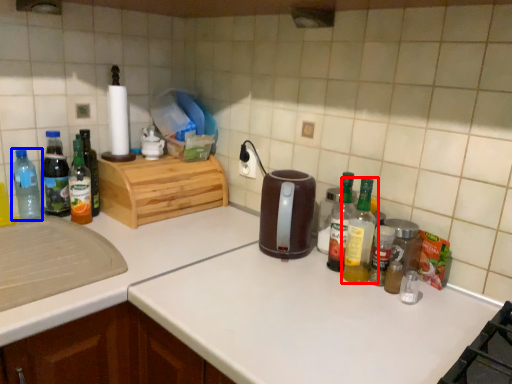
Question: Which of the following is the farthest to the observer, bottle (highlighted by a red box) or bottle (highlighted by a blue box)?

Choices:
 (A) bottle
 (B) bottle

Answer: (B)